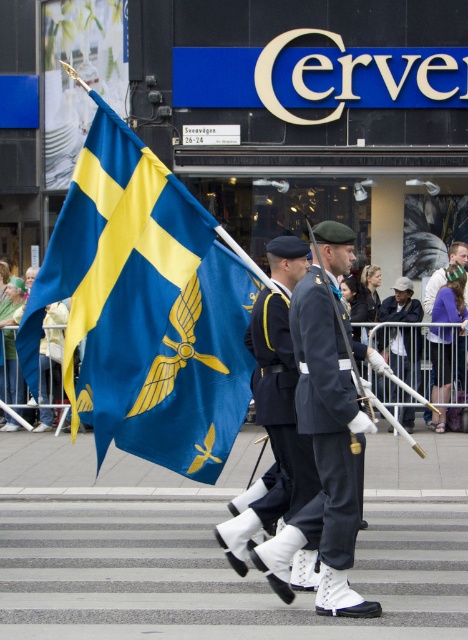
Does dark blue uniform at center lie behind dark blue fabric uniform at center?

No, it is in front of dark blue fabric uniform at center.

Which is in front, point (320, 300) or point (272, 465)?

Point (320, 300) is in front.

Where is `dark blue uniform at center`? This screenshot has width=468, height=640. dark blue uniform at center is located at coordinates (326, 433).

Is dark blue fabric uniform at center thinner than white matte uniform at center?

Yes, dark blue fabric uniform at center is thinner than white matte uniform at center.

The width and height of the screenshot is (468, 640). What do you see at coordinates (278, 410) in the screenshot? I see `dark blue fabric uniform at center` at bounding box center [278, 410].

Is point (277, 337) farther from camera compared to point (418, 352)?

No, it is in front of (418, 352).

The image size is (468, 640). Identify the location of dark blue fabric uniform at center. (278, 410).

Can you confirm if dark blue uniform at center is thinner than navy blue fabric uniform at center?

No.

Does point (351, 394) come farther from viewer compared to point (333, 518)?

No, (351, 394) is closer to viewer.

Who is more forward, (336, 330) or (302, 524)?

Point (336, 330) is more forward.

I want to click on dark blue uniform at center, so click(x=326, y=433).